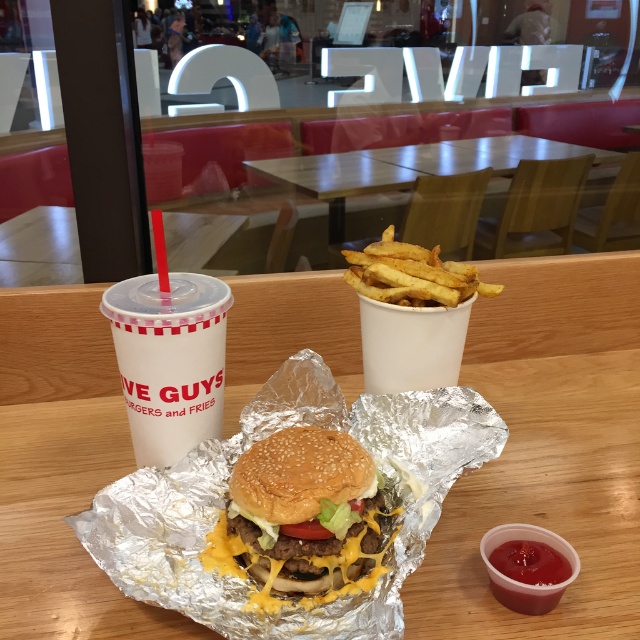
This screenshot has height=640, width=640. Describe the element at coordinates (301, 518) in the screenshot. I see `golden brown bun at center` at that location.

How distant is golden brown bun at center from white paper cup at center?

21.48 centimeters

Does point (241, 488) come closer to viewer compared to point (390, 355)?

Yes.

This screenshot has width=640, height=640. I want to click on golden brown bun at center, so click(x=301, y=518).

Is point (109, 360) positioned in front of point (291, 538)?

That is False.

Image resolution: width=640 pixels, height=640 pixels. What do you see at coordinates (547, 449) in the screenshot?
I see `wooden table at center` at bounding box center [547, 449].

Between point (109, 436) and point (333, 560), which one is positioned behind?

The point (109, 436) is behind.

Locate an element on the screen. wooden table at center is located at coordinates (547, 449).

Is white paper cup at center to the right of golden crispy fries at center from the viewer's perspective?

In fact, white paper cup at center is to the left of golden crispy fries at center.

I want to click on white paper cup at center, so click(x=410, y=344).